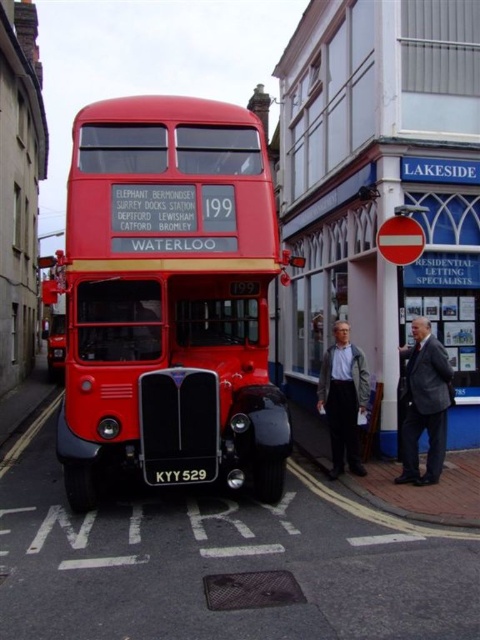
Does shiny red bus at center appear on the right side of dark gray suit at center?

Incorrect, shiny red bus at center is not on the right side of dark gray suit at center.

Who is more forward, (129, 365) or (403, 468)?

Point (129, 365) is in front.

You are a GUI agent. You are given a task and a screenshot of the screen. Output one action in this format:
    pyautogui.click(x=<x>, y=<y>)
    Task: Click on the shiny red bus at center
    The width and height of the screenshot is (480, 640).
    Given the screenshot: What is the action you would take?
    pyautogui.click(x=169, y=296)

Image resolution: width=480 pixels, height=640 pixels. Describe the element at coordinates (424, 404) in the screenshot. I see `dark gray suit at center` at that location.

Does dark gray suit at center have a larger size compared to black matte license plate at center?

Correct, dark gray suit at center is larger in size than black matte license plate at center.

Which is in front, point (418, 330) or point (195, 468)?

Point (195, 468) is more forward.

Where is `dark gray suit at center`? The height and width of the screenshot is (640, 480). dark gray suit at center is located at coordinates (424, 404).

Consider the image. Does dark gray suit at center have a lesser width compared to gray fabric jacket at lower center?

In fact, dark gray suit at center might be wider than gray fabric jacket at lower center.

Looking at this image, is dark gray suit at center wider than gray fabric jacket at lower center?

Yes.

Is point (444, 445) in front of point (342, 433)?

Yes.

At what (x,y) coordinates should I click in order to perform the action: click on dark gray suit at center. Please return your answer as a coordinate pair (x, y). This screenshot has width=480, height=640. Looking at the image, I should click on (424, 404).